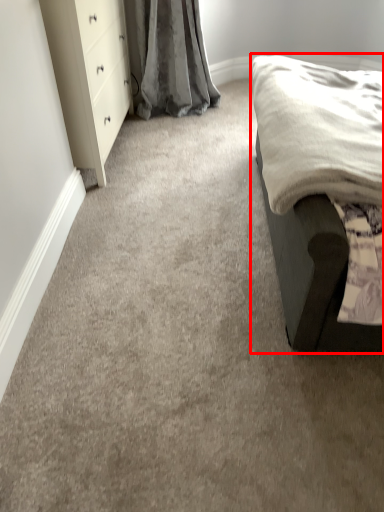
Question: From the image, what is the correct spatial relationship of furniture (annotated by the red box) in relation to chest of drawers?

Choices:
 (A) right
 (B) left

Answer: (A)